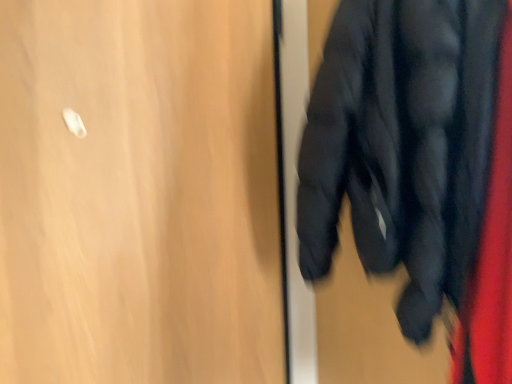
In order to face matte black jacket at right, should I rotate leftwards or rightwards?

Turn right by 16.095 degrees to look at matte black jacket at right.

Locate an element on the screen. matte black jacket at right is located at coordinates (402, 144).

The height and width of the screenshot is (384, 512). Describe the element at coordinates (402, 144) in the screenshot. I see `matte black jacket at right` at that location.

Measure the distance between wooden door at upper left and camera.

They are 30.37 inches apart.

In order to face wooden door at upper left, should I rotate leftwards or rightwards?

Turn left by 11.537 degrees to look at wooden door at upper left.

Image resolution: width=512 pixels, height=384 pixels. Find the location of `wooden door at upper left`. wooden door at upper left is located at coordinates [x=139, y=193].

What is the approximate width of wooden door at upper left?

wooden door at upper left is 8.11 centimeters in width.

Describe the element at coordinates (139, 193) in the screenshot. Image resolution: width=512 pixels, height=384 pixels. I see `wooden door at upper left` at that location.

The width and height of the screenshot is (512, 384). Find the location of `matte black jacket at right`. matte black jacket at right is located at coordinates (402, 144).

From the picture: Considering the positions of objects matte black jacket at right and wooden door at upper left in the image provided, who is more to the left, matte black jacket at right or wooden door at upper left?

wooden door at upper left is more to the left.

Which is behind, matte black jacket at right or wooden door at upper left?

Positioned behind is wooden door at upper left.

Is point (426, 252) in front of point (33, 240)?

Yes, point (426, 252) is in front of point (33, 240).

Looking at this image, from the image's perspective, which one is positioned higher, matte black jacket at right or wooden door at upper left?

From the image's view, matte black jacket at right is above.

From a real-world perspective, is matte black jacket at right located beneath wooden door at upper left?

Incorrect, from a real-world perspective, matte black jacket at right is higher than wooden door at upper left.

Is matte black jacket at right thinner than wooden door at upper left?

No.

Can you confirm if matte black jacket at right is taller than wooden door at upper left?

No, matte black jacket at right is not taller than wooden door at upper left.

Considering the sizes of objects matte black jacket at right and wooden door at upper left in the image provided, who is bigger, matte black jacket at right or wooden door at upper left?

Bigger between the two is matte black jacket at right.

Is matte black jacket at right spatially inside wooden door at upper left, or outside of it?

matte black jacket at right is not inside wooden door at upper left, it's outside.

Is matte black jacket at right far away from wooden door at upper left?

No, matte black jacket at right is in close proximity to wooden door at upper left.

Is wooden door at upper left at the back of matte black jacket at right?

matte black jacket at right does not have its back to wooden door at upper left.

How many degrees apart are the facing directions of matte black jacket at right and wooden door at upper left?

They differ by 88.9 degrees in their facing directions.

How far apart are matte black jacket at right and wooden door at upper left?

matte black jacket at right and wooden door at upper left are 15.47 inches apart.

Locate an element on the screen. The height and width of the screenshot is (384, 512). door that appears behind the matte black jacket at right is located at coordinates (139, 193).

Looking at this image, in the image, is wooden door at upper left on the left side or the right side of matte black jacket at right?

In the image, wooden door at upper left appears on the left side of matte black jacket at right.

Is wooden door at upper left in front of or behind matte black jacket at right in the image?

Clearly, wooden door at upper left is behind matte black jacket at right.

Between point (157, 5) and point (392, 126), which one is positioned in front?

Positioned in front is point (392, 126).

From the image's perspective, is wooden door at upper left on matte black jacket at right?

No, from the image's perspective, wooden door at upper left is not over matte black jacket at right.

From a real-world perspective, is wooden door at upper left located beneath matte black jacket at right?

Yes.

Considering the sizes of wooden door at upper left and matte black jacket at right in the image, is wooden door at upper left wider or thinner than matte black jacket at right?

wooden door at upper left is thinner than matte black jacket at right.

Considering the relative sizes of wooden door at upper left and matte black jacket at right in the image provided, is wooden door at upper left shorter than matte black jacket at right?

Incorrect, the height of wooden door at upper left does not fall short of that of matte black jacket at right.

Who is bigger, wooden door at upper left or matte black jacket at right?

matte black jacket at right.

Is wooden door at upper left not within matte black jacket at right?

Absolutely, wooden door at upper left is external to matte black jacket at right.

Is wooden door at upper left beside matte black jacket at right?

No, wooden door at upper left is not in contact with matte black jacket at right.

Is matte black jacket at right at the back of wooden door at upper left?

wooden door at upper left is not turned away from matte black jacket at right.

How different are the orientations of wooden door at upper left and matte black jacket at right in degrees?

wooden door at upper left and matte black jacket at right are facing 88.9 degrees away from each other.

Image resolution: width=512 pixels, height=384 pixels. Find the location of `jacket above the wooden door at upper left (from the image's perspective)`. jacket above the wooden door at upper left (from the image's perspective) is located at coordinates (402, 144).

Locate an element on the screen. The height and width of the screenshot is (384, 512). door below the matte black jacket at right (from the image's perspective) is located at coordinates [139, 193].

In order to click on door lying on the left of matte black jacket at right in this screenshot , I will do `click(139, 193)`.